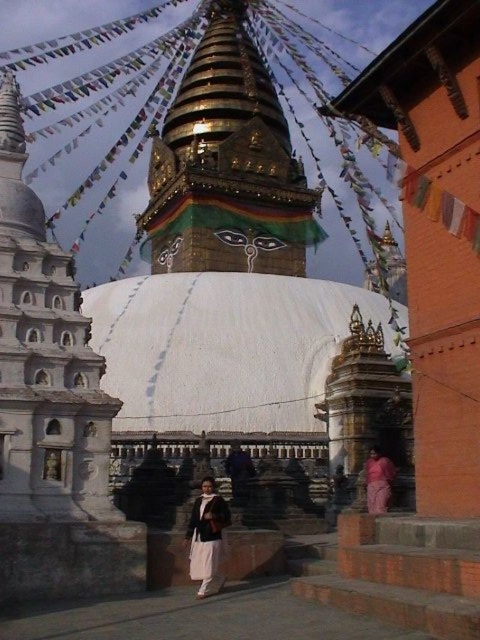
Question: Can you confirm if gold/gilded stupa at center is positioned to the left of white cotton robe at center?

Choices:
 (A) no
 (B) yes

Answer: (B)

Question: In this image, where is gold/gilded stupa at center located relative to white cotton robe at center?

Choices:
 (A) right
 (B) left

Answer: (B)

Question: Which point is closer to the camera taking this photo?

Choices:
 (A) (365, 468)
 (B) (192, 564)
 (C) (214, 88)

Answer: (B)

Question: Among these objects, which one is farthest from the camera?

Choices:
 (A) gold/gilded stupa at center
 (B) pink fabric at lower right
 (C) white cotton robe at center

Answer: (A)

Question: Is white cotton robe at center wider than pink fabric at lower right?

Choices:
 (A) no
 (B) yes

Answer: (B)

Question: Among these objects, which one is nearest to the camera?

Choices:
 (A) pink fabric at lower right
 (B) gold/gilded stupa at center

Answer: (A)